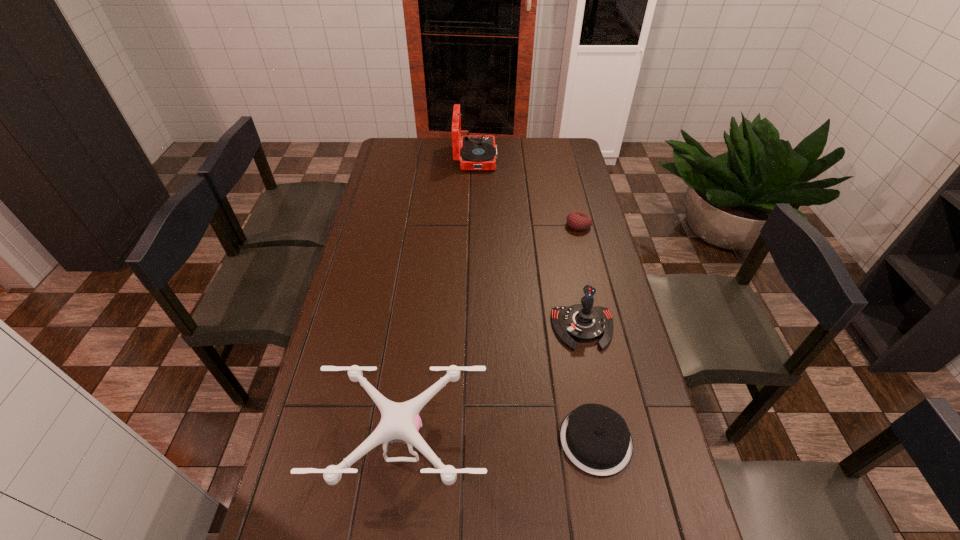
Image resolution: width=960 pixels, height=540 pixels. Identify the location of empty location between the third farthest object and the drone. (493, 385).

Find the location of a particular element. This screenshot has height=540, width=960. empty space that is in between the beanbag and the drone is located at coordinates (492, 334).

The height and width of the screenshot is (540, 960). In order to click on vacant space in between the pancake and the third farthest object in this screenshot , I will do `click(589, 384)`.

Identify the location of blank region between the fourth nearest object and the joystick. (581, 276).

Locate an element on the screen. vacant region between the tallest object and the fourth nearest object is located at coordinates (527, 192).

At what (x,y) coordinates should I click in order to perform the action: click on free area in between the pancake and the drone. Please return your answer as a coordinate pair (x, y). Looking at the image, I should click on (500, 441).

Select which object appears as the closest to the phonograph_record. Please provide its 2D coordinates. Your answer should be formatted as a tuple, i.e. [(x, y)], where the tuple contains the x and y coordinates of a point satisfying the conditions above.

[(578, 221)]

Where is `object that stands as the fourth closest to the drone`? The width and height of the screenshot is (960, 540). object that stands as the fourth closest to the drone is located at coordinates (478, 152).

Identify the location of blank space that satisfies the following two spatial constraints: 1. on the back side of the beanbag; 2. on the front-facing side of the phonograph_record. (562, 158).

I want to click on blank area in the image that satisfies the following two spatial constraints: 1. on the front-facing side of the farthest object; 2. on the top of the drone, so click(x=472, y=442).